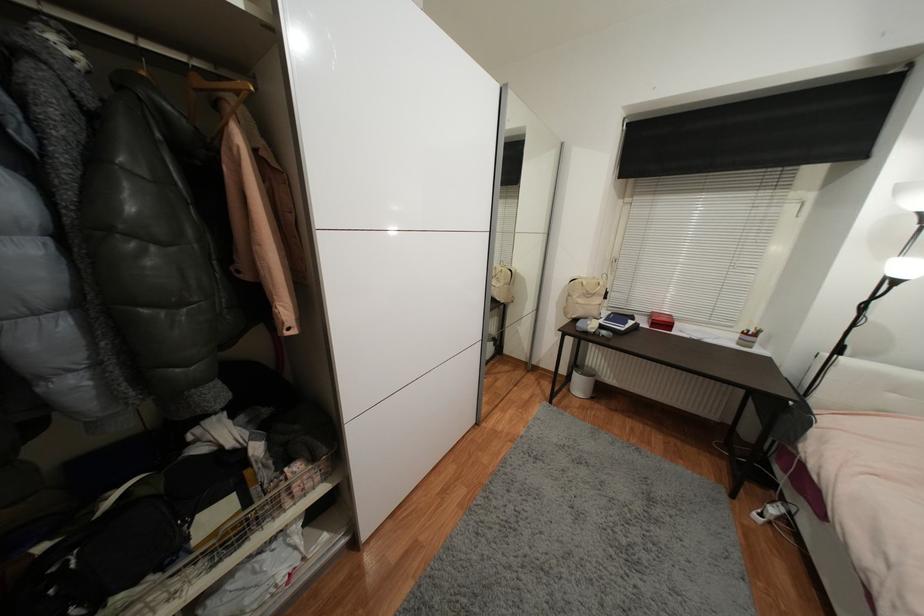
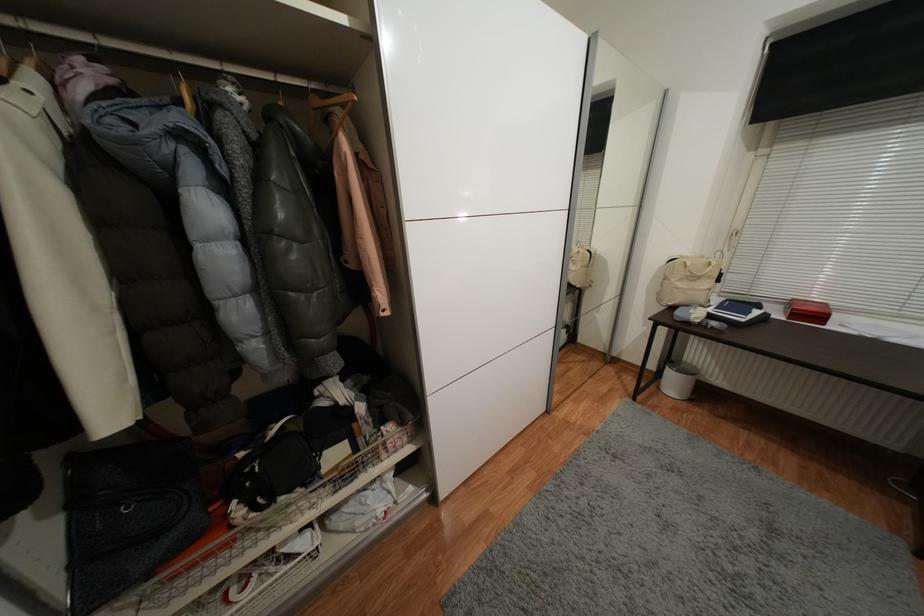
The point at (220,567) is marked in the first image. Where is the corresponding point in the second image?

(342, 493)